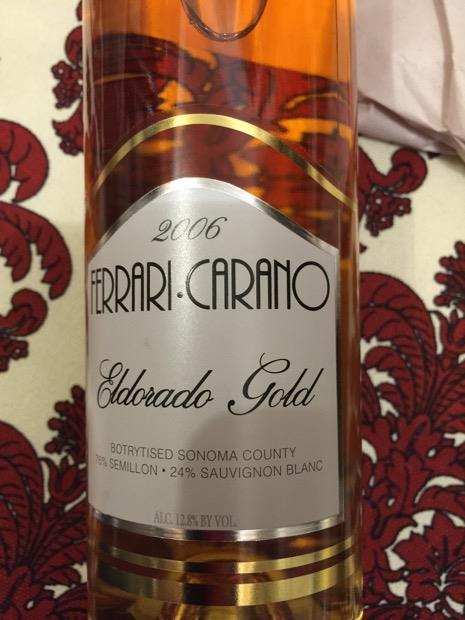
What are the coordinates of `curtains` in the screenshot? It's located at (422, 59).